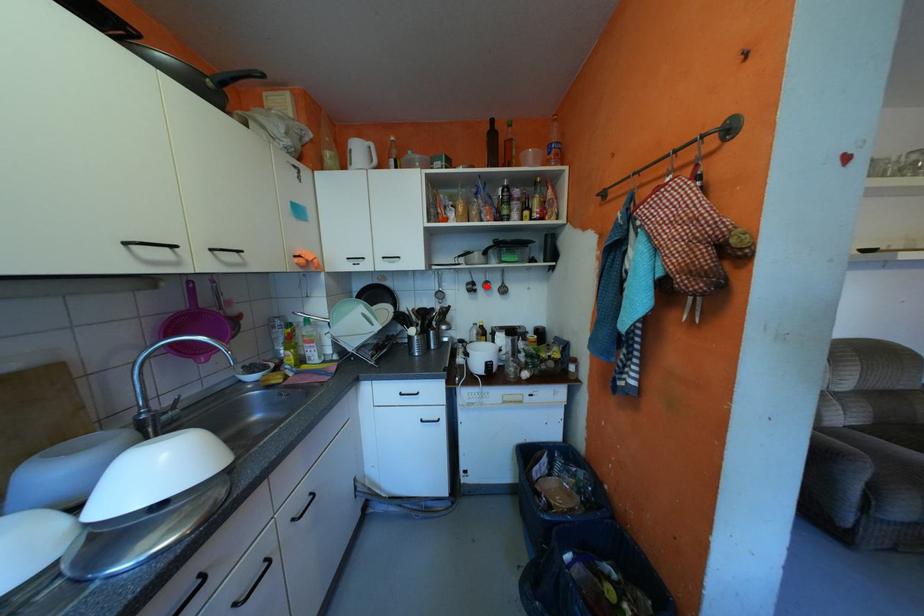
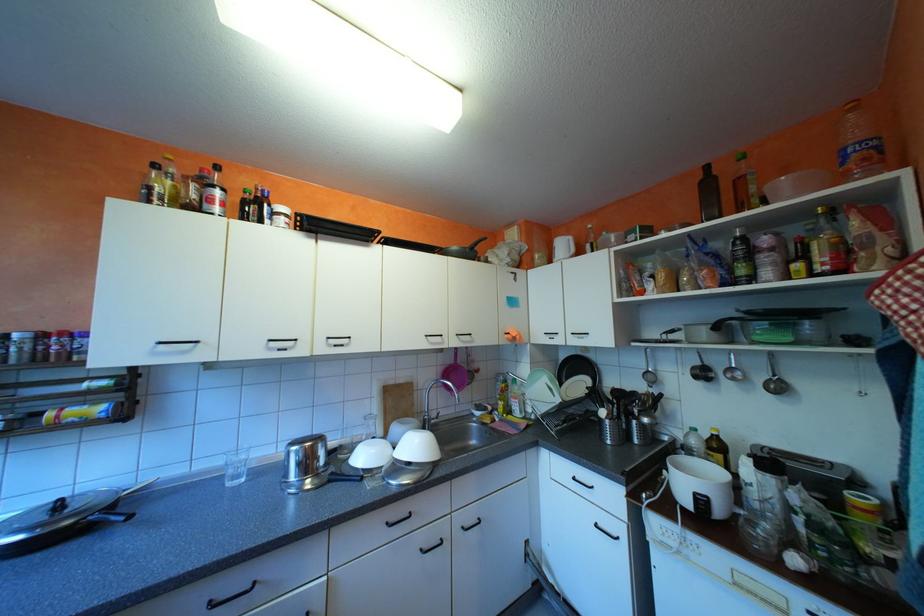
Find the pixel in the second image that matches the highlighted location in the first image.

(723, 374)